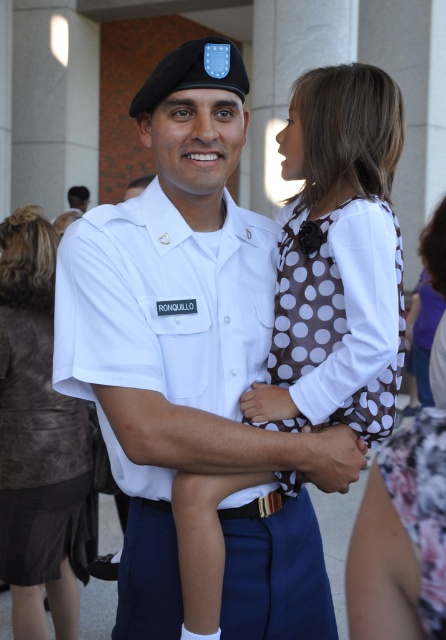
You are a tailor who needs to determine which item requires more fabric to make between the white uniform at center and the brown suede jacket at upper left. Which one would need more fabric?

The white uniform at center is larger in size than the brown suede jacket at upper left, so it would require more fabric to make.

You are a fashion designer observing the image. You need to determine which item has a greater height between the brown dotted dress at center and the brown dotted fabric at upper center. Which one is taller?

The brown dotted dress at center is much taller as brown dotted fabric at upper center.

You are a photographer taking a photo of the scene. You want to ensure both the brown dotted dress at center and the brown suede jacket at upper left are clearly visible. Which object should you focus on first to make sure it is in sharp focus?

The brown dotted dress at center should be focused on first because it is in front of the brown suede jacket at upper left, so focusing on it ensures both will be in focus if they are within the same depth of field.